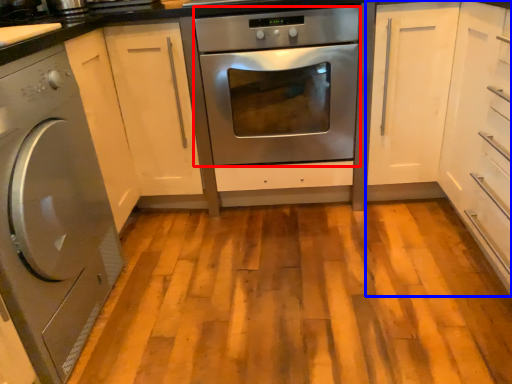
Question: Which object is closer to the camera taking this photo, oven (highlighted by a red box) or cabinetry (highlighted by a blue box)?

Choices:
 (A) oven
 (B) cabinetry

Answer: (B)